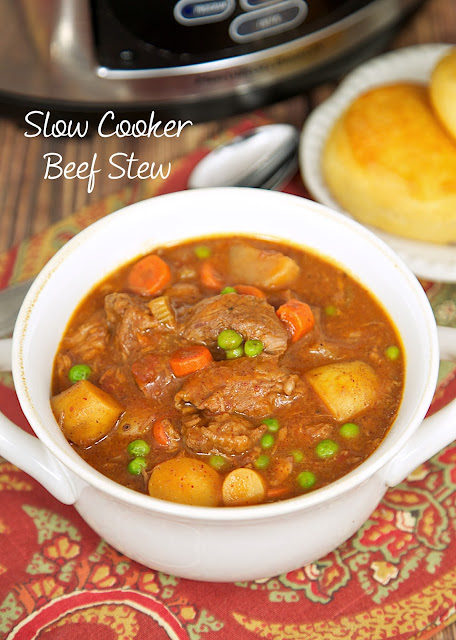
The height and width of the screenshot is (640, 456). In order to click on plate in this screenshot , I will do `click(430, 257)`.